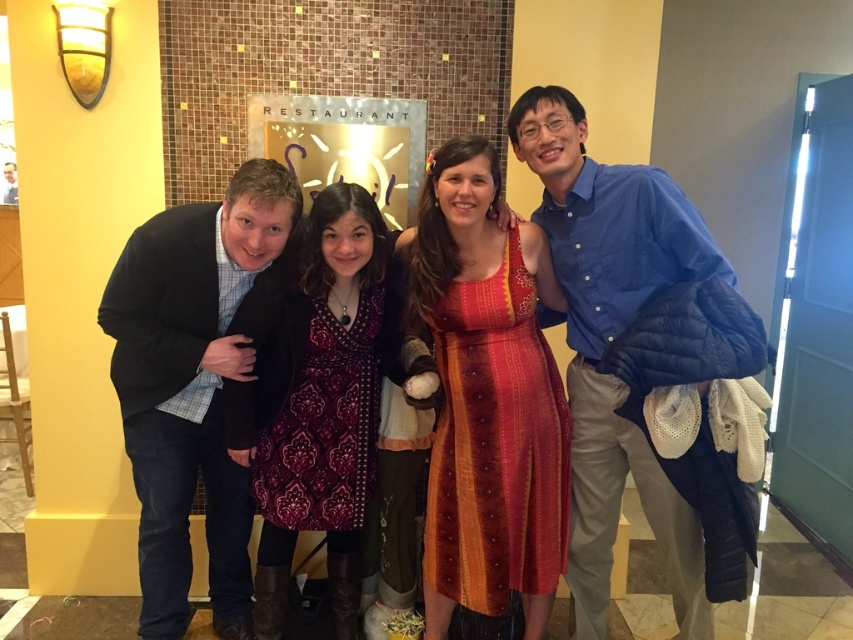
What do you see at coordinates (192, 385) in the screenshot? Image resolution: width=853 pixels, height=640 pixels. I see `blue cotton shirt at left` at bounding box center [192, 385].

Between point (210, 586) and point (231, 438), which one is positioned behind?

Positioned behind is point (210, 586).

Find the location of `blue cotton shirt at left`. blue cotton shirt at left is located at coordinates (192, 385).

Between blue cotton shirt at right and patterned fabric dress at center, which one has more height?

blue cotton shirt at right

I want to click on blue cotton shirt at right, so click(608, 342).

Describe the element at coordinates (608, 342) in the screenshot. I see `blue cotton shirt at right` at that location.

Locate an element on the screen. The height and width of the screenshot is (640, 853). blue cotton shirt at right is located at coordinates coord(608,342).

Between matte black jacket at left and blue cotton shirt at right, which one is positioned lower?

blue cotton shirt at right

What do you see at coordinates (631, 364) in the screenshot? I see `matte black jacket at left` at bounding box center [631, 364].

Does point (709, 598) lie behind point (668, 490)?

No, it is not.

I want to click on matte black jacket at left, so click(631, 364).